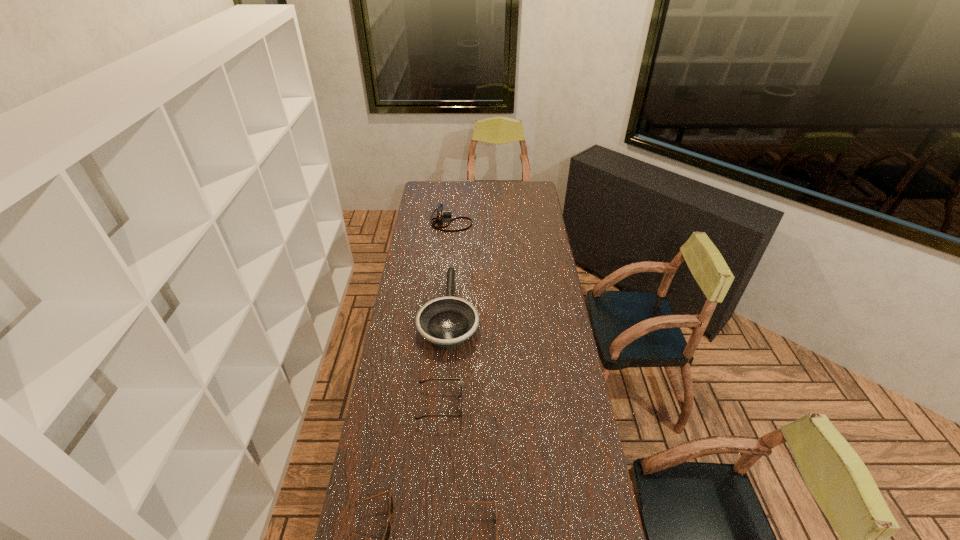
At what (x,y) coordinates should I click in order to perform the action: click on the second closest object to the farthest sunglasses. Please return your answer as a coordinate pair (x, y). This screenshot has width=960, height=540. Looking at the image, I should click on (387, 534).

Identify which object is the nearest to the fourth nearest object. Please provide its 2D coordinates. Your answer should be formatted as a tuple, i.e. [(x, y)], where the tuple contains the x and y coordinates of a point satisfying the conditions above.

[(420, 382)]

Identify which sunglasses is the nearest to the camera. Please provide its 2D coordinates. Your answer should be formatted as a tuple, i.e. [(x, y)], where the tuple contains the x and y coordinates of a point satisfying the conditions above.

[(420, 382)]

Select which sunglasses is the second closest to the leftmost sunglasses. Please provide its 2D coordinates. Your answer should be formatted as a tuple, i.e. [(x, y)], where the tuple contains the x and y coordinates of a point satisfying the conditions above.

[(420, 382)]

Identify the location of blank area in the image that satisfies the following two spatial constraints: 1. on the front-facing side of the farthest object; 2. on the handle side of the frying pan. (444, 311).

Identify the location of vacant region that satisfies the following two spatial constraints: 1. on the handle side of the frying pan; 2. on the front-facing side of the farthest object. Image resolution: width=960 pixels, height=540 pixels. (456, 222).